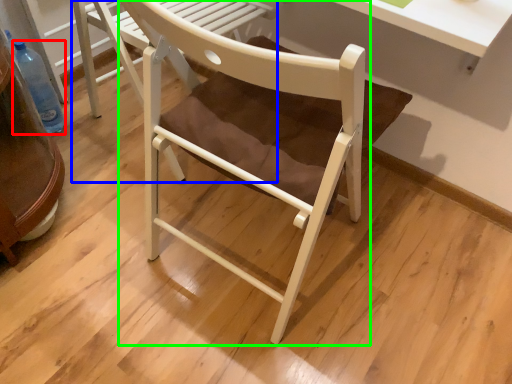
Question: Based on their relative distances, which object is nearer to bottle (highlighted by a red box)? Choose from chair (highlighted by a blue box) and chair (highlighted by a green box).

Choices:
 (A) chair
 (B) chair

Answer: (A)